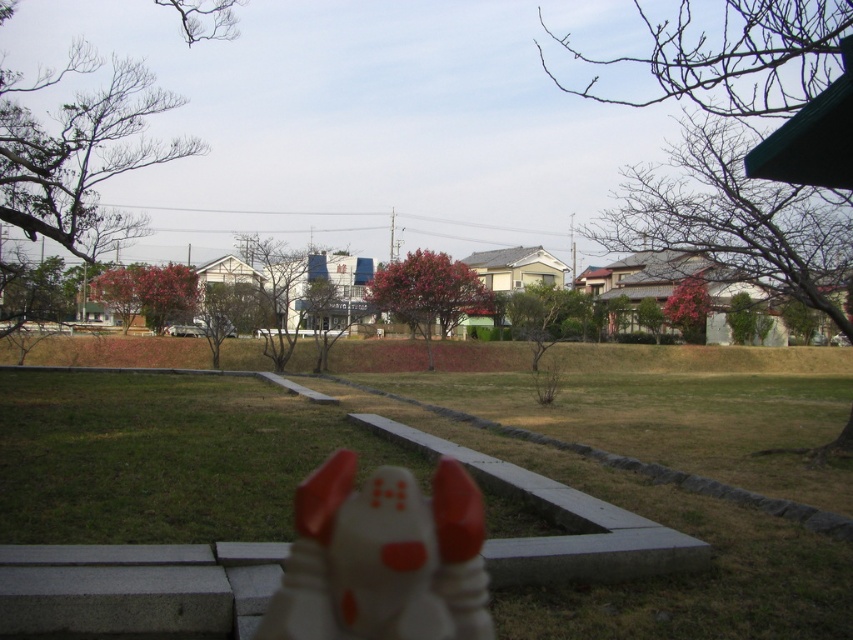
In the scene shown: You are a gardener who needs to water the green grass at center and the white matte dog at center. Your watering can holds enough water for 5 meters of travel. Can you water both without refilling?

The green grass at center and white matte dog at center are 7.62 meters apart from each other. Since the watering can only allows for 5 meters of travel, you cannot water both without refilling.

You are a gardener who wants to plant a new flower bed in the green grass at center. Considering the size of the white matte dog at center, will there be enough space for a flower bed that is twice the size of the dog?

The green grass at center has a larger size compared to the white matte dog at center, so there should be enough space to plant a flower bed twice the size of the white matte dog at center.